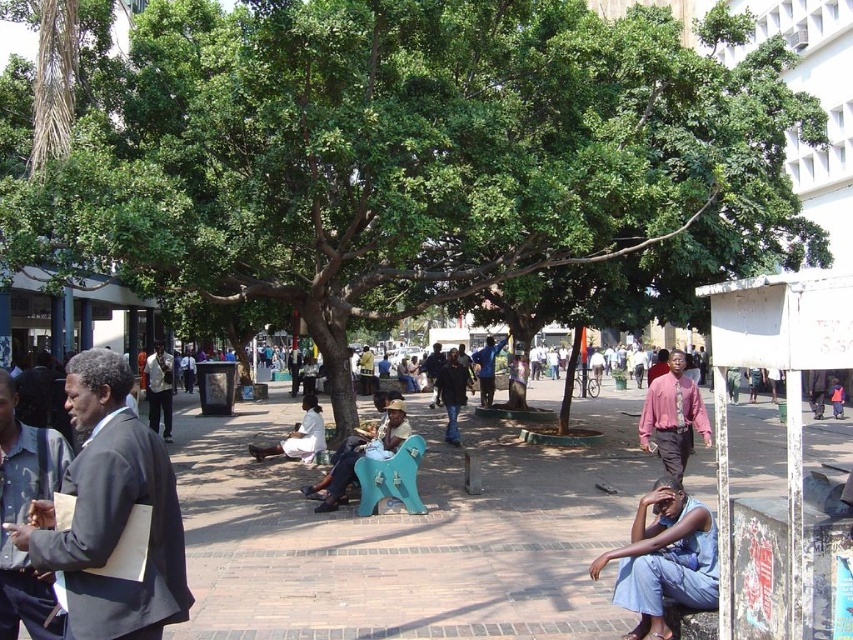
You are a photographer setting up a tripod in the park. You need to position it so that both the dark brown leather jacket at left and the white cloth at center are visible in the frame. Given their height difference, which object might block the view of the other if placed closer to the camera?

The dark brown leather jacket at left is taller than the white cloth at center. Therefore, if positioned closer to the camera, it could block the view of the white cloth at center.

You are standing at the point with coordinates point (x=0, y=600) and want to walk towards the point with coordinates point (x=317, y=440). Which direction should you face to move directly towards it?

You should face north because point (x=0, y=600) is in front of point (x=317, y=440), meaning it is closer to you. To reach the latter, you need to move away from your current position towards the north direction.

You are standing in the park and want to place a small potted plant on the ground between the brick pavement at center and the dark blue jeans at center. Based on their positions, which object should the plant be closer to?

The brick pavement at center is closer to the viewer than dark blue jeans at center, so the plant should be placed closer to the dark blue jeans at center to maintain a balanced distance between both objects.